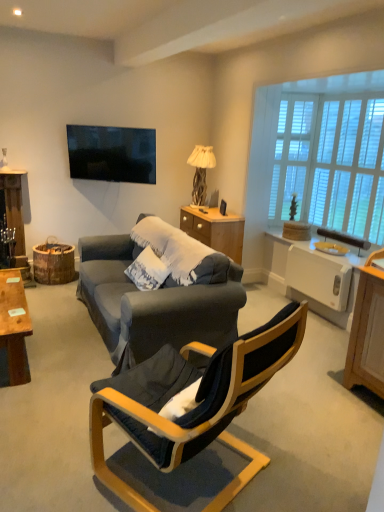
Locate an element on the screen. The height and width of the screenshot is (512, 384). vacant space to the right of wooden desk at left is located at coordinates (61, 357).